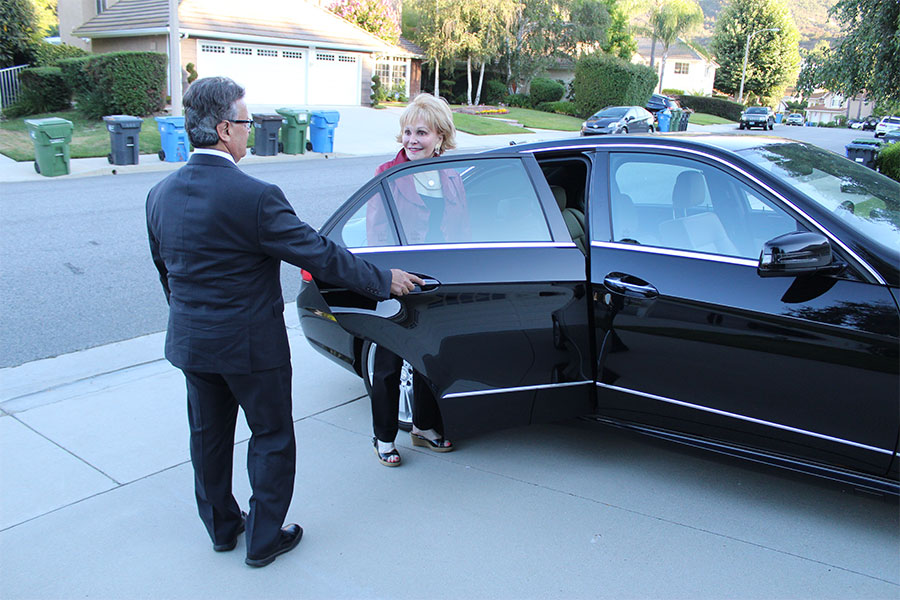
This screenshot has height=600, width=900. Find the location of `garbage bins`. garbage bins is located at coordinates point(48,144), point(118,136), point(178,134), point(271,131), point(295,126), point(326,124), point(666,119), point(677,119), point(681,119), point(861,149).